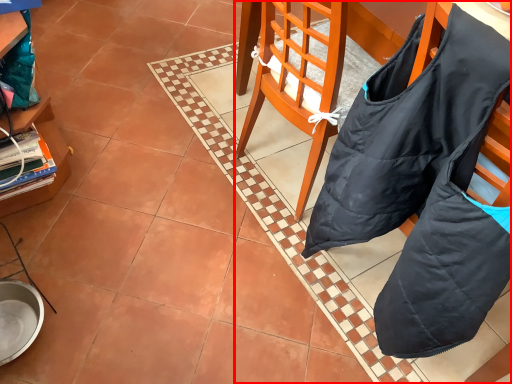
Question: In this image, where is chair (annotated by the red box) located relative to cabinetry?

Choices:
 (A) left
 (B) right

Answer: (B)